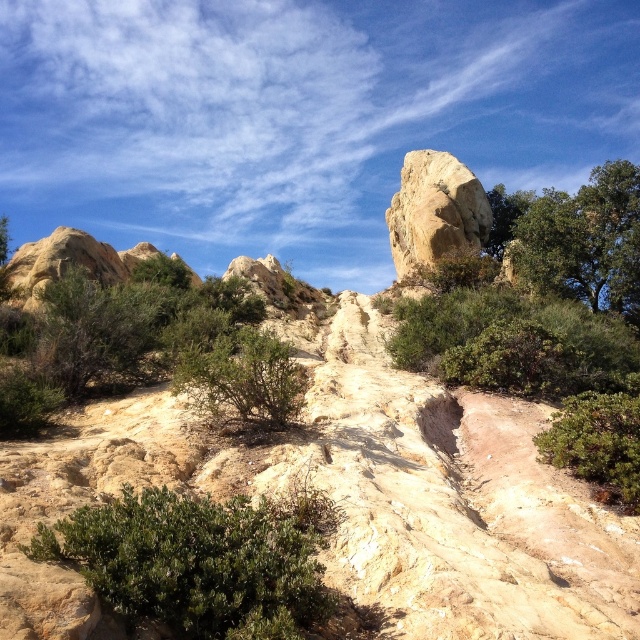
Question: Can you confirm if green leafy bush at center is bigger than rustic stone boulder at center?

Choices:
 (A) no
 (B) yes

Answer: (A)

Question: Is green leafy bush at lower left positioned before rustic stone boulder at center?

Choices:
 (A) no
 (B) yes

Answer: (B)

Question: Which object is positioned farthest from the green leafy bush at lower right?

Choices:
 (A) rustic stone boulder at center
 (B) green leafy tree at upper right
 (C) green leafy bush at lower left

Answer: (A)

Question: Does green leafy bush at center lie in front of green leafy bush at lower right?

Choices:
 (A) yes
 (B) no

Answer: (B)

Question: Among these points, which one is nearest to the camera?

Choices:
 (A) (572, 436)
 (B) (209, 518)

Answer: (B)

Question: Which point is farther to the camera?

Choices:
 (A) green leafy bush at center
 (B) green leafy bush at lower left
 (C) green leafy bush at lower right

Answer: (A)